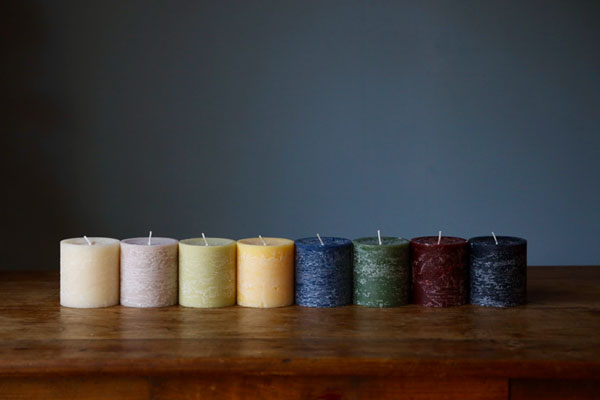
Identify the location of candles. The width and height of the screenshot is (600, 400). (88, 271), (157, 278), (205, 283), (277, 282), (316, 281), (384, 281), (448, 285), (511, 284).